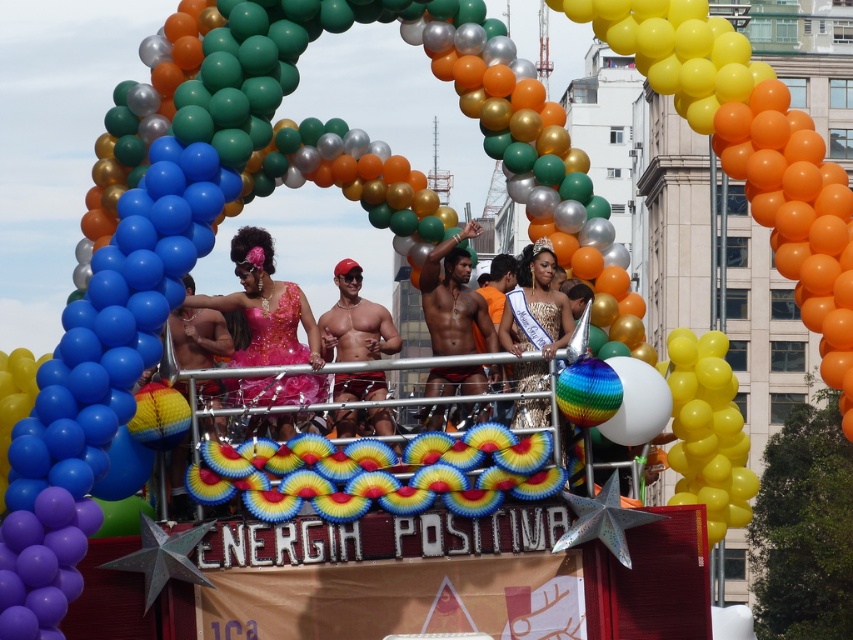
Question: Which of the following is the closest to the observer?

Choices:
 (A) sparkly pink dress at center
 (B) shiny red shorts at center
 (C) shiny metallic shorts at center
 (D) gold sequined dress at center

Answer: (A)

Question: Does shiny metallic shorts at center come in front of shiny red shorts at center?

Choices:
 (A) no
 (B) yes

Answer: (A)

Question: Which point is farther from the camera taking this photo?

Choices:
 (A) (343, 330)
 (B) (424, 310)
 (C) (543, 323)
 (D) (283, 323)

Answer: (A)

Question: Is sparkly pink dress at center above gold sequined dress at center?

Choices:
 (A) yes
 (B) no

Answer: (B)

Question: Which point appears closest to the camera in this image?

Choices:
 (A) (244, 381)
 (B) (508, 304)

Answer: (A)

Question: Can you confirm if shiny metallic shorts at center is positioned to the left of shiny red shorts at center?

Choices:
 (A) no
 (B) yes

Answer: (A)